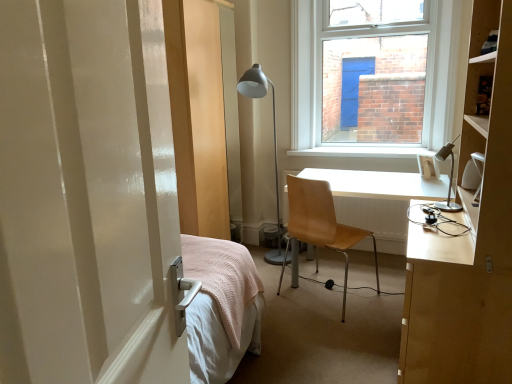
Locate an element on the screen. space that is in front of light brown wood desk at center right is located at coordinates (351, 339).